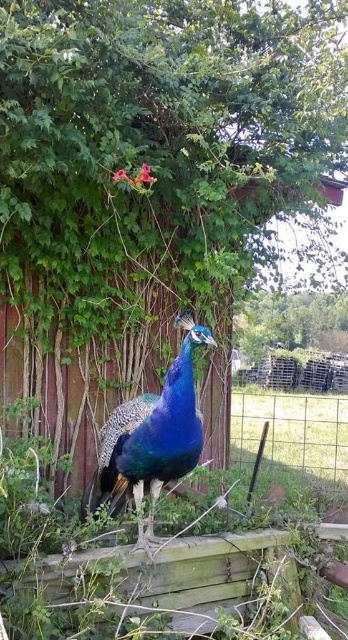
Consider the image. You are a photographer trying to capture a photo of the shiny blue peacock at center and the wire mesh fence at lower right in the same frame. Based on their positions, which object should you adjust your camera to focus on first to ensure both are in the frame?

The shiny blue peacock at center is to the left of the wire mesh fence at lower right. To include both in the frame, focus on the shiny blue peacock at center first since it is positioned further left, allowing you to adjust the camera to include the wire mesh fence at lower right on the right side of the frame.

From the picture: You are a birdwatcher trying to capture a photo of the shiny blue peacock at center. You notice a wire mesh fence at lower right nearby. Based on the scene, which object is taller?

The shiny blue peacock at center is much taller than the wire mesh fence at lower right.

Consider the image. You are a photographer trying to capture the shiny blue peacock at center. You notice the wire mesh fence at lower right in the background. Can you determine if the fence is closer to you or farther away than the peacock?

The shiny blue peacock at center is in front of the wire mesh fence at lower right, so the fence is farther away than the peacock.